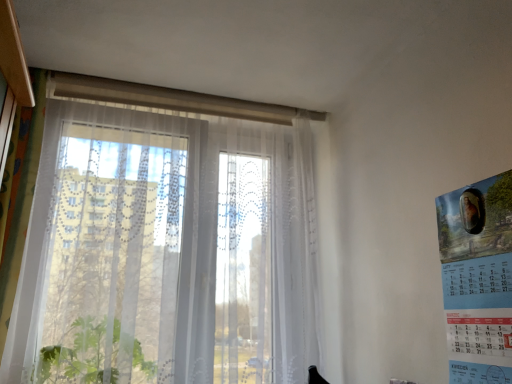
Question: From the image's perspective, is transparent fabric window at center located above blue paper calendar at right?

Choices:
 (A) yes
 (B) no

Answer: (A)

Question: From a real-world perspective, is transparent fabric window at center on blue paper calendar at right?

Choices:
 (A) yes
 (B) no

Answer: (A)

Question: From the image's perspective, would you say transparent fabric window at center is shown under blue paper calendar at right?

Choices:
 (A) no
 (B) yes

Answer: (A)

Question: Does transparent fabric window at center have a larger size compared to blue paper calendar at right?

Choices:
 (A) yes
 (B) no

Answer: (A)

Question: Is transparent fabric window at center further to camera compared to blue paper calendar at right?

Choices:
 (A) yes
 (B) no

Answer: (A)

Question: Is transparent fabric window at center facing away from blue paper calendar at right?

Choices:
 (A) no
 (B) yes

Answer: (A)

Question: From the image's perspective, is blue paper calendar at right located beneath transparent fabric window at center?

Choices:
 (A) no
 (B) yes

Answer: (B)

Question: Is blue paper calendar at right to the left of transparent fabric window at center from the viewer's perspective?

Choices:
 (A) no
 (B) yes

Answer: (A)

Question: Considering the relative positions of blue paper calendar at right and transparent fabric window at center in the image provided, is blue paper calendar at right behind transparent fabric window at center?

Choices:
 (A) yes
 (B) no

Answer: (B)

Question: From a real-world perspective, is blue paper calendar at right under transparent fabric window at center?

Choices:
 (A) no
 (B) yes

Answer: (B)

Question: Is blue paper calendar at right positioned in front of transparent fabric window at center?

Choices:
 (A) yes
 (B) no

Answer: (A)

Question: Is blue paper calendar at right directly adjacent to transparent fabric window at center?

Choices:
 (A) no
 (B) yes

Answer: (A)

Question: Considering the positions of blue paper calendar at right and transparent fabric window at center in the image, is blue paper calendar at right taller or shorter than transparent fabric window at center?

Choices:
 (A) short
 (B) tall

Answer: (A)